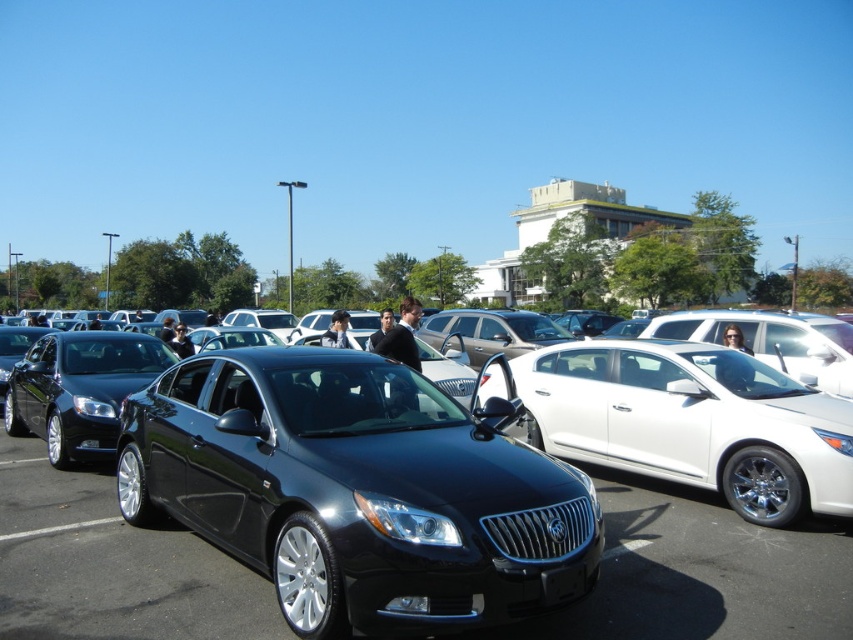
Is white glossy sedan at center further to camera compared to glossy black sedan at center?

That is False.

Is point (647, 432) farther from viewer compared to point (113, 422)?

No, (647, 432) is closer to viewer.

This screenshot has height=640, width=853. Describe the element at coordinates (693, 422) in the screenshot. I see `white glossy sedan at center` at that location.

You are a GUI agent. You are given a task and a screenshot of the screen. Output one action in this format:
    pyautogui.click(x=<x>, y=<y>)
    Task: Click on the white glossy sedan at center
    
    Given the screenshot: What is the action you would take?
    pyautogui.click(x=693, y=422)

Does glossy black car at center appear over glossy black sedan at center?

Actually, glossy black car at center is below glossy black sedan at center.

Can you confirm if glossy black car at center is shorter than glossy black sedan at center?

Correct, glossy black car at center is not as tall as glossy black sedan at center.

The width and height of the screenshot is (853, 640). What are the coordinates of `glossy black car at center` in the screenshot? It's located at (703, 572).

Between white glossy sedan at center and black rubber line at lower left, which one appears on the right side from the viewer's perspective?

Positioned to the right is white glossy sedan at center.

Identify the location of white glossy sedan at center. The image size is (853, 640). (693, 422).